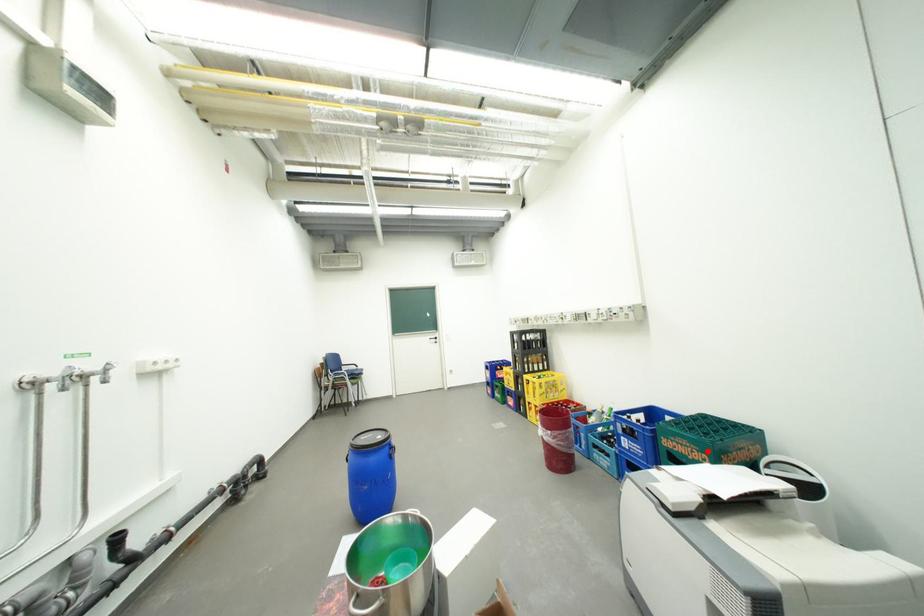
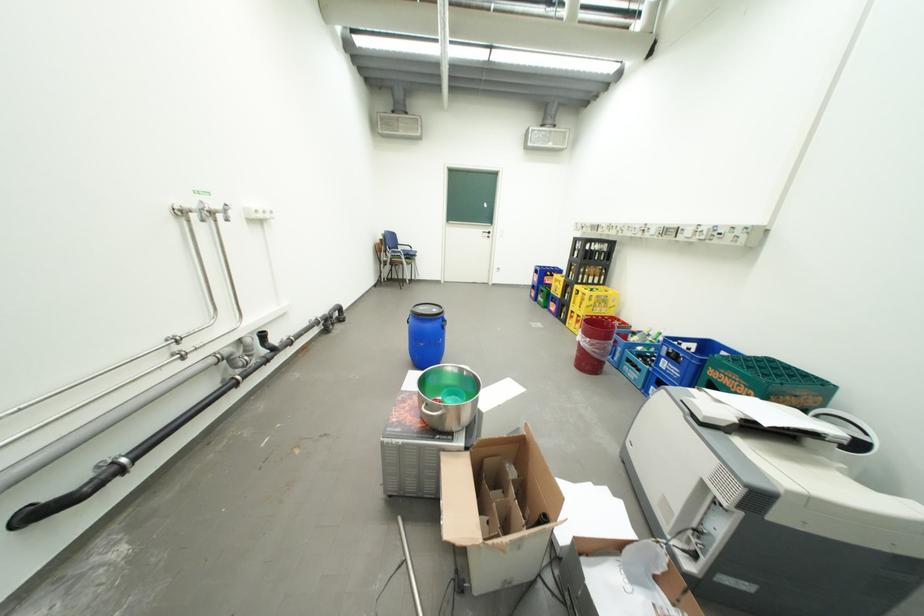
Find the pixel in the second image that matches the highlighted location in the first image.

(756, 387)